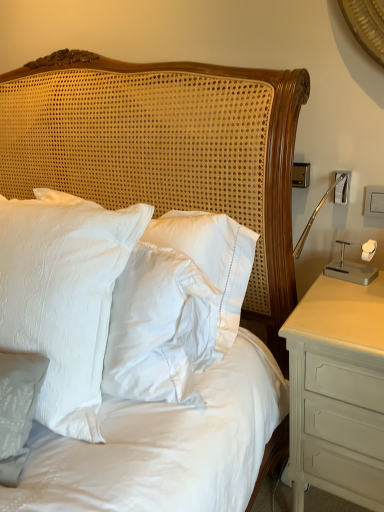
Question: From the image's perspective, is white satin pillow at center positioned above or below white satin pillows at center?

Choices:
 (A) below
 (B) above

Answer: (A)

Question: From a real-world perspective, is white satin pillow at center above or below white satin pillows at center?

Choices:
 (A) above
 (B) below

Answer: (A)

Question: Estimate the real-world distances between objects in this image. Which object is farther from the white painted wood nightstand at right?

Choices:
 (A) white satin pillows at center
 (B) white satin pillow at center

Answer: (B)

Question: Based on their relative distances, which object is farther from the white satin pillow at center?

Choices:
 (A) white painted wood nightstand at right
 (B) white satin pillows at center

Answer: (A)